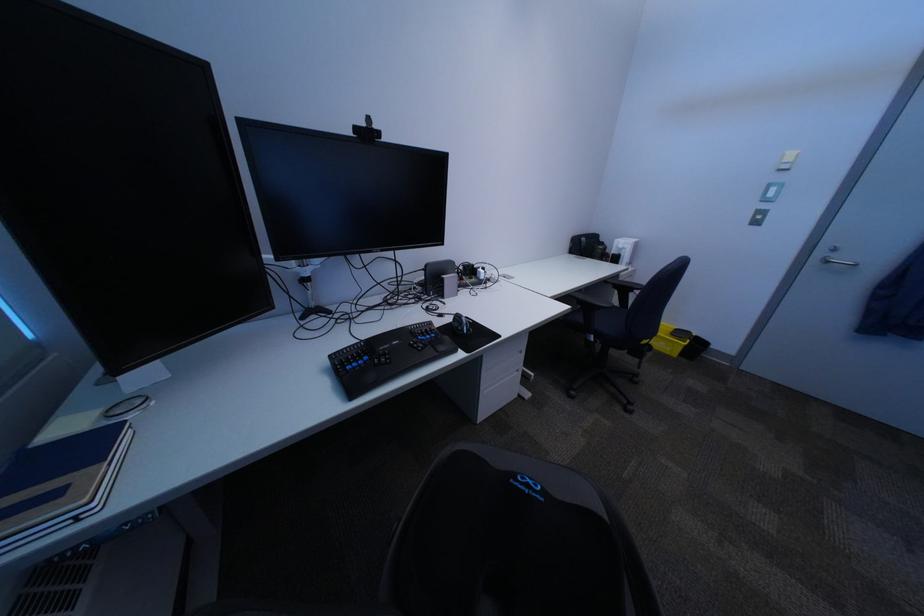
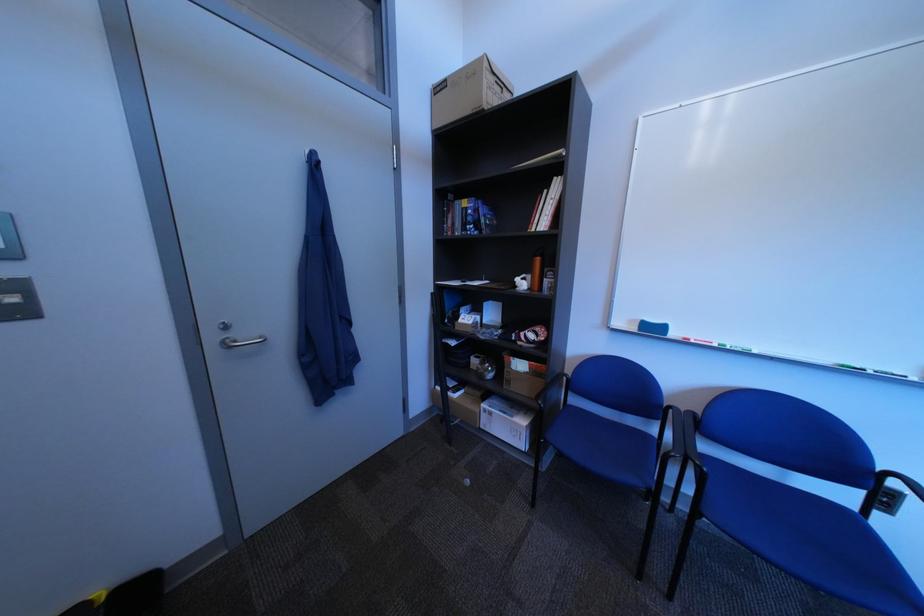
The point at [834,254] is marked in the first image. Where is the corresponding point in the second image?

(226, 339)